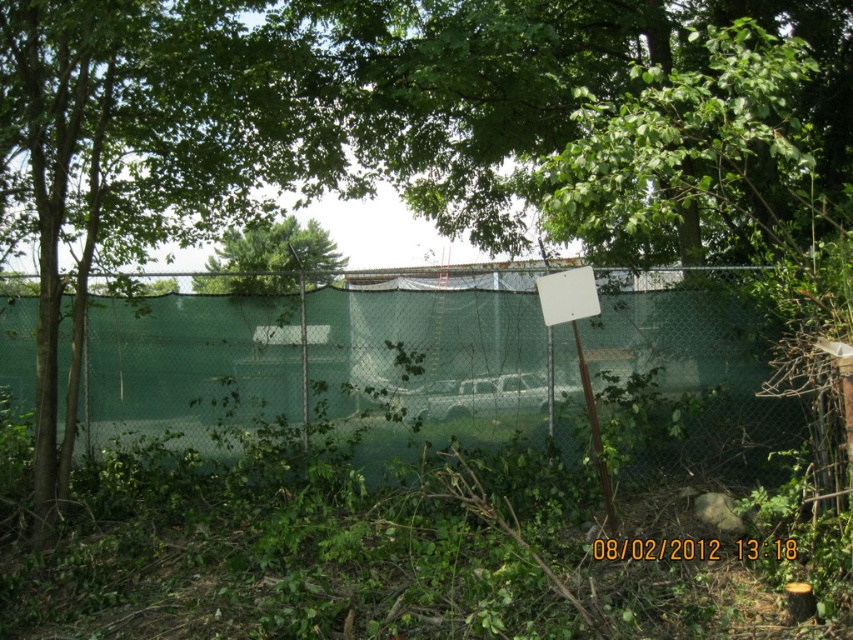
Question: Is green mesh fence at center smaller than green leafy tree at center?

Choices:
 (A) yes
 (B) no

Answer: (A)

Question: Among these objects, which one is nearest to the camera?

Choices:
 (A) green mesh fence at center
 (B) green leafy tree at center

Answer: (A)

Question: Is green mesh fence at center closer to the viewer compared to green leafy tree at center?

Choices:
 (A) yes
 (B) no

Answer: (A)

Question: Does green mesh fence at center have a lesser width compared to green leafy tree at center?

Choices:
 (A) yes
 (B) no

Answer: (A)

Question: Which point appears farthest from the camera in this image?

Choices:
 (A) (254, 234)
 (B) (173, 420)

Answer: (A)